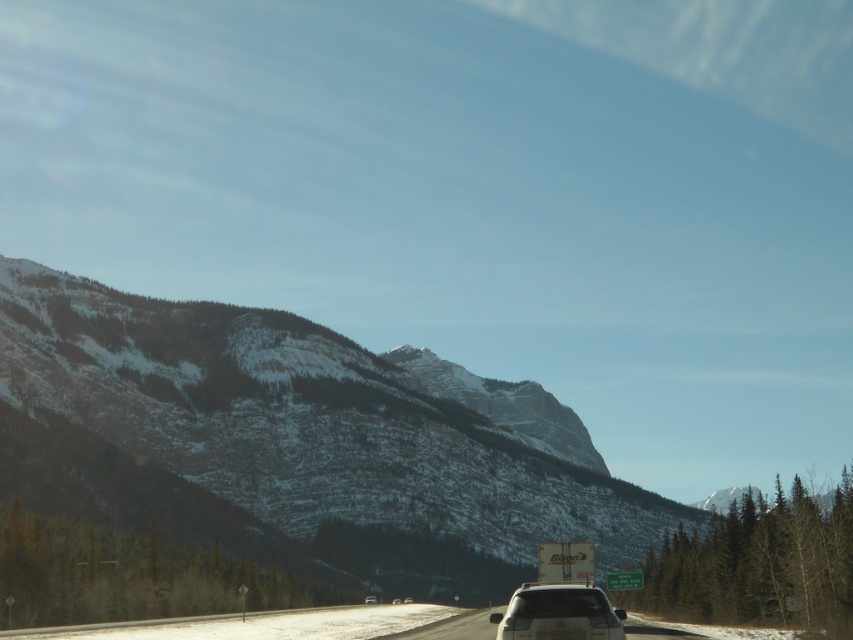
Looking at this image, which is above, snowy rock mountain at center or white matte car at center?

Positioned higher is white matte car at center.

Does snowy rock mountain at center appear over white matte car at center?

Incorrect, snowy rock mountain at center is not positioned above white matte car at center.

Identify the location of snowy rock mountain at center. (299, 440).